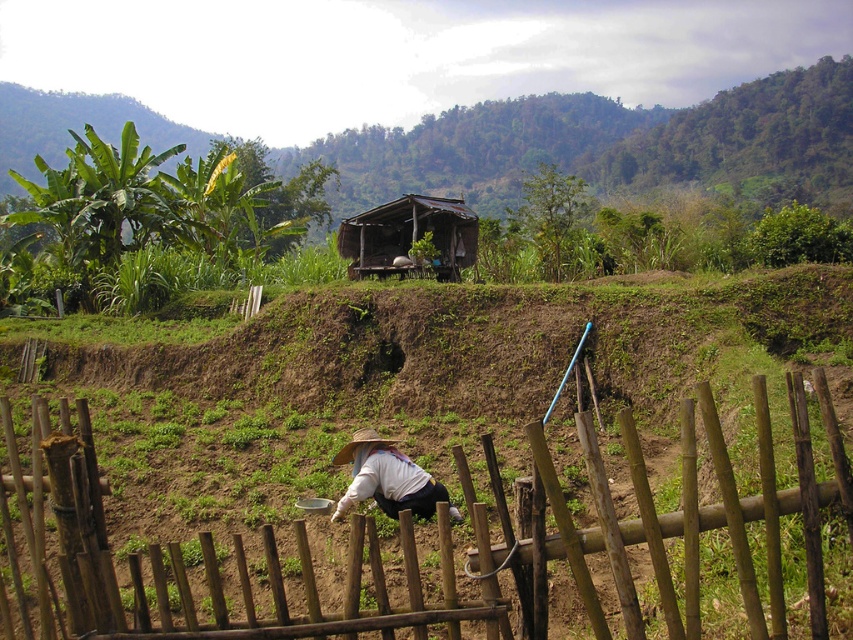
Between brown wooden fence at center and white woven hat at lower center, which one has less height?

Standing shorter between the two is white woven hat at lower center.

Who is taller, brown wooden fence at center or white woven hat at lower center?

Standing taller between the two is brown wooden fence at center.

Who is more distant from viewer, [648,497] or [352,486]?

The point [352,486] is behind.

Identify the location of brown wooden fence at center. (276, 573).

Can you confirm if brown thatched hut at center is positioned below white woven hat at lower center?

No.

Can you confirm if brown thatched hut at center is wider than white woven hat at lower center?

Yes, brown thatched hut at center is wider than white woven hat at lower center.

Does point (409, 205) come closer to viewer compared to point (405, 476)?

That is False.

Identify the location of brown thatched hut at center. This screenshot has width=853, height=640. (409, 236).

From the picture: Who is positioned more to the right, brown wooden fence at center or brown thatched hut at center?

brown wooden fence at center is more to the right.

Is brown wooden fence at center to the right of brown thatched hut at center from the viewer's perspective?

Indeed, brown wooden fence at center is positioned on the right side of brown thatched hut at center.

Looking at this image, who is more distant from viewer, (791, 387) or (459, 253)?

The point (459, 253) is behind.

At what (x,y) coordinates should I click in order to perform the action: click on brown wooden fence at center. Please return your answer as a coordinate pair (x, y). This screenshot has width=853, height=640. Looking at the image, I should click on (276, 573).